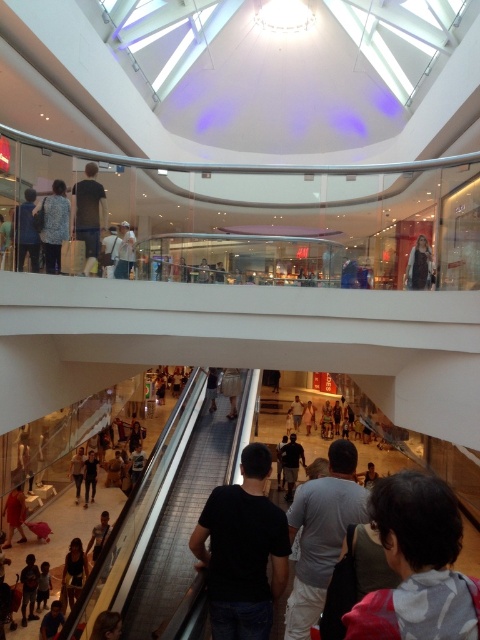
Can you confirm if black matte t-shirt at center is positioned below light brown leather jacket at upper center?

Correct, black matte t-shirt at center is located below light brown leather jacket at upper center.

Is point (265, 595) farther from camera compared to point (130, 230)?

No, it is in front of (130, 230).

The image size is (480, 640). What are the coordinates of `black matte t-shirt at center` in the screenshot? It's located at (242, 550).

Is black matte t-shirt at center wider than dark gray shirt at center?

In fact, black matte t-shirt at center might be narrower than dark gray shirt at center.

Who is positioned more to the right, black matte t-shirt at center or dark gray shirt at center?

dark gray shirt at center

Is point (264, 516) behind point (279, 456)?

No, it is in front of (279, 456).

Locate an element on the screen. This screenshot has width=480, height=640. black matte t-shirt at center is located at coordinates (242, 550).

Between blonde hair at lower left and light brown leather jacket at center, which one is positioned lower?

blonde hair at lower left

Is point (115, 612) positioned behind point (292, 403)?

No, it is not.

Is point (95, 625) in front of point (297, 412)?

That is True.

Locate an element on the screen. This screenshot has width=480, height=640. blonde hair at lower left is located at coordinates (107, 625).